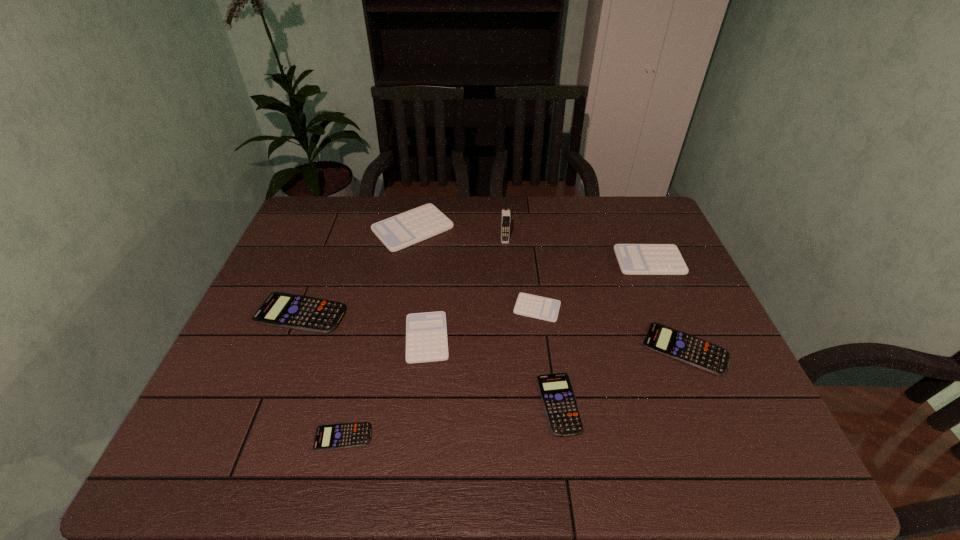
Identify the location of vacant position located 0.180m on the back of the rightmost blue calculator. (654, 276).

Where is `vacant region located 0.270m on the left of the third biggest blue calculator`? The image size is (960, 540). vacant region located 0.270m on the left of the third biggest blue calculator is located at coordinates (418, 404).

Locate an element on the screen. The image size is (960, 540). free space located on the back of the smallest blue calculator is located at coordinates (363, 355).

I want to click on cellular telephone at the far edge, so click(505, 217).

Locate an element on the screen. This screenshot has width=960, height=540. calculator at the far edge is located at coordinates (403, 230).

Locate an element on the screen. object present at the left edge is located at coordinates (305, 313).

Locate an element on the screen. The image size is (960, 540). blank space at the far edge of the desktop is located at coordinates (555, 228).

Where is `vacant space at the near edge of the desktop`? vacant space at the near edge of the desktop is located at coordinates (605, 460).

At what (x,y) coordinates should I click in order to perform the action: click on vacant position at the left edge of the desktop. Please return your answer as a coordinate pair (x, y). The image size is (960, 540). Looking at the image, I should click on tap(282, 392).

This screenshot has width=960, height=540. I want to click on vacant space at the right edge, so click(x=706, y=394).